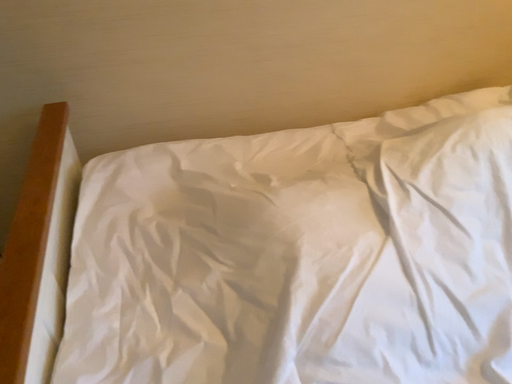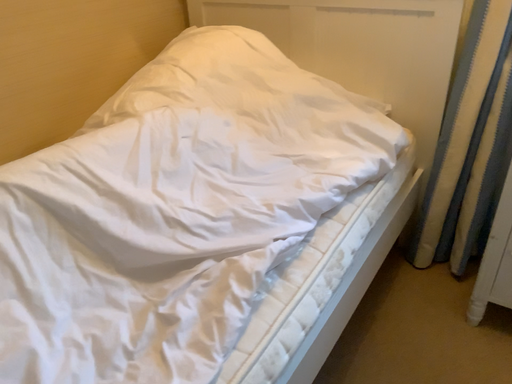
Question: How did the camera likely rotate when shooting the video?

Choices:
 (A) rotated right
 (B) rotated left

Answer: (A)